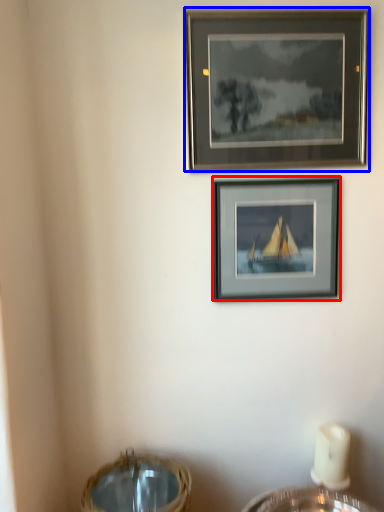
Question: Which object is further to the camera taking this photo, picture frame (highlighted by a red box) or picture frame (highlighted by a blue box)?

Choices:
 (A) picture frame
 (B) picture frame

Answer: (A)